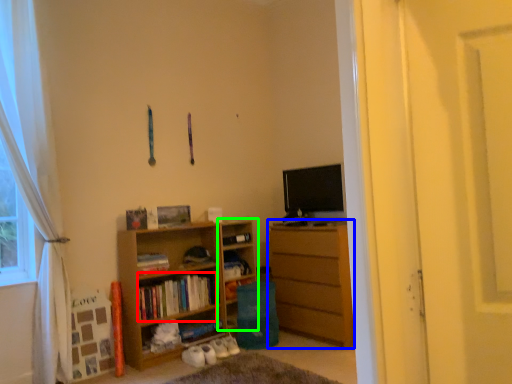
Question: Based on their relative distances, which object is farther from book (highlighted by a red box)? Choose from chest of drawers (highlighted by a blue box) and cabinet (highlighted by a green box).

Choices:
 (A) chest of drawers
 (B) cabinet

Answer: (A)